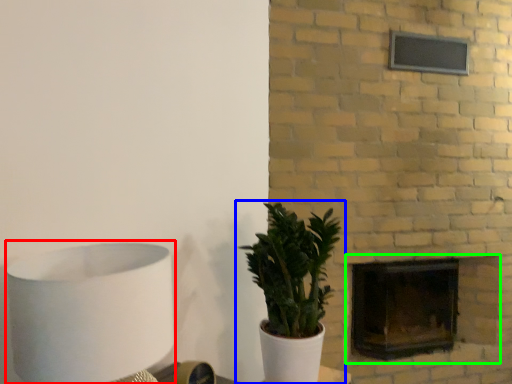
Question: Which object is positioned farthest from table lamp (highlighted by a red box)? Select from houseplant (highlighted by a blue box) and fireplace (highlighted by a green box).

Choices:
 (A) houseplant
 (B) fireplace

Answer: (B)